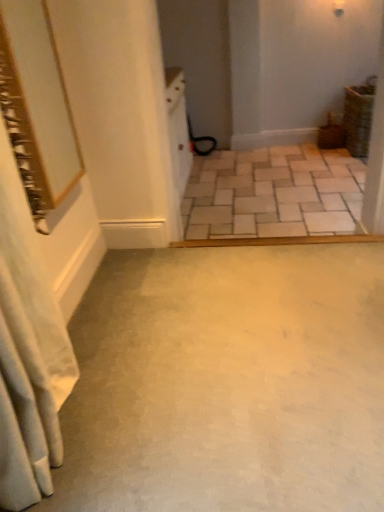
Question: Is gold-framed mirror at upper left wider than white fabric shower curtain at left?

Choices:
 (A) no
 (B) yes

Answer: (A)

Question: Can you confirm if gold-framed mirror at upper left is bigger than white fabric shower curtain at left?

Choices:
 (A) yes
 (B) no

Answer: (B)

Question: From the image's perspective, is gold-framed mirror at upper left located beneath white fabric shower curtain at left?

Choices:
 (A) no
 (B) yes

Answer: (A)

Question: Is gold-framed mirror at upper left behind white fabric shower curtain at left?

Choices:
 (A) yes
 (B) no

Answer: (A)

Question: From a real-world perspective, is gold-framed mirror at upper left positioned over white fabric shower curtain at left based on gravity?

Choices:
 (A) yes
 (B) no

Answer: (A)

Question: Considering their positions, is gold-framed mirror at upper left located in front of or behind smooth concrete floor at center, placed as the 1th concrete when sorted from front to back?

Choices:
 (A) behind
 (B) front

Answer: (A)

Question: Is point (54, 39) positioned closer to the camera than point (317, 466)?

Choices:
 (A) closer
 (B) farther

Answer: (B)

Question: Is gold-framed mirror at upper left bigger or smaller than smooth concrete floor at center, placed as the 1th concrete when sorted from front to back?

Choices:
 (A) small
 (B) big

Answer: (A)

Question: Which is correct: gold-framed mirror at upper left is inside smooth concrete floor at center, placed as the 1th concrete when sorted from front to back, or outside of it?

Choices:
 (A) outside
 (B) inside

Answer: (A)

Question: From a real-world perspective, is smooth concrete floor at center, the second concrete in the back-to-front sequence, physically located above or below white fabric shower curtain at left?

Choices:
 (A) below
 (B) above

Answer: (A)

Question: Considering the positions of smooth concrete floor at center, the second concrete in the back-to-front sequence, and white fabric shower curtain at left in the image, is smooth concrete floor at center, the second concrete in the back-to-front sequence, wider or thinner than white fabric shower curtain at left?

Choices:
 (A) thin
 (B) wide

Answer: (B)

Question: Considering their positions, is smooth concrete floor at center, acting as the second concrete starting from the top, located in front of or behind white fabric shower curtain at left?

Choices:
 (A) behind
 (B) front

Answer: (A)

Question: Is point (187, 266) positioned closer to the camera than point (19, 375)?

Choices:
 (A) farther
 (B) closer

Answer: (A)

Question: Is beige stone tiles at center, marked as the 2th concrete in a bottom-to-top arrangement, taller or shorter than gold-framed mirror at upper left?

Choices:
 (A) short
 (B) tall

Answer: (A)

Question: Considering the positions of point (208, 204) and point (57, 106), is point (208, 204) closer or farther from the camera than point (57, 106)?

Choices:
 (A) closer
 (B) farther

Answer: (B)